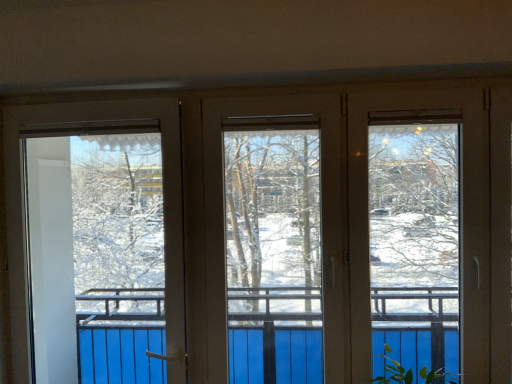
Question: Choose the correct answer: Is green leafy plant at lower right inside transparent plastic screen door at left or outside it?

Choices:
 (A) outside
 (B) inside

Answer: (A)

Question: Considering the positions of green leafy plant at lower right and transparent plastic screen door at left in the image, is green leafy plant at lower right taller or shorter than transparent plastic screen door at left?

Choices:
 (A) tall
 (B) short

Answer: (B)

Question: In the image, is green leafy plant at lower right on the left side or the right side of transparent plastic screen door at left?

Choices:
 (A) right
 (B) left

Answer: (A)

Question: Is transparent plastic screen door at left bigger or smaller than green leafy plant at lower right?

Choices:
 (A) big
 (B) small

Answer: (B)

Question: From the image's perspective, relative to green leafy plant at lower right, is transparent plastic screen door at left above or below?

Choices:
 (A) below
 (B) above

Answer: (B)

Question: Is point (139, 163) positioned closer to the camera than point (408, 382)?

Choices:
 (A) farther
 (B) closer

Answer: (A)

Question: From a real-world perspective, is transparent plastic screen door at left positioned above or below green leafy plant at lower right?

Choices:
 (A) above
 (B) below

Answer: (A)